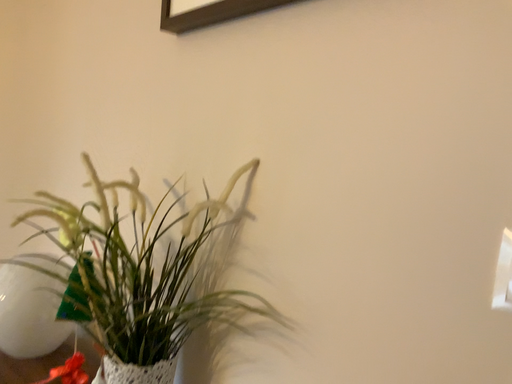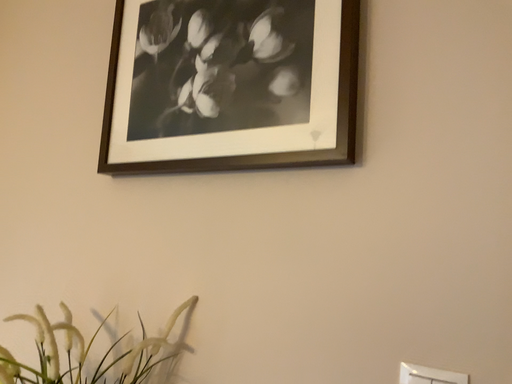
Question: How did the camera likely rotate when shooting the video?

Choices:
 (A) rotated left
 (B) rotated right

Answer: (B)